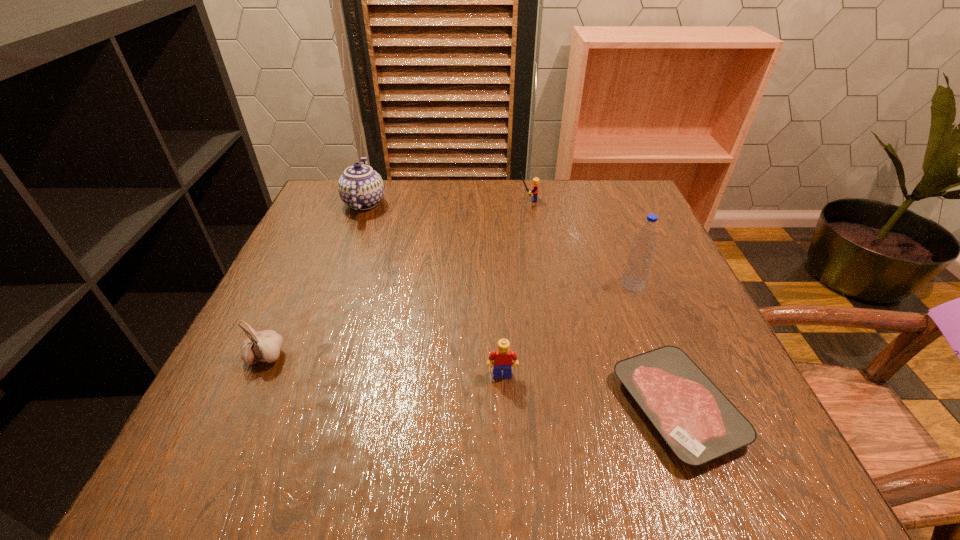
Locate an element on the screen. The width and height of the screenshot is (960, 540). the fourth nearest object is located at coordinates (637, 268).

Identify the location of the tallest object. (637, 268).

At what (x,y) coordinates should I click in order to perform the action: click on chinaware. Please return your answer as a coordinate pair (x, y). Image resolution: width=960 pixels, height=540 pixels. Looking at the image, I should click on (360, 187).

Find the location of a particular element. The image size is (960, 540). the fourth object from left to right is located at coordinates (535, 187).

Identify the location of the right Lego. (535, 187).

Identify the location of the left Lego. The height and width of the screenshot is (540, 960). (501, 359).

The image size is (960, 540). Identify the location of the third object from left to right. (501, 359).

Where is `garlic`? This screenshot has height=540, width=960. garlic is located at coordinates (265, 346).

Locate an element on the screen. The width and height of the screenshot is (960, 540). the shortest object is located at coordinates (699, 423).

You are a GUI agent. You are given a task and a screenshot of the screen. Output one action in this format:
    pyautogui.click(x=<x>, y=<y>)
    Task: Click on the vacant space situated on the front of the water bottle
    The height and width of the screenshot is (540, 960).
    Given the screenshot: What is the action you would take?
    pyautogui.click(x=675, y=392)